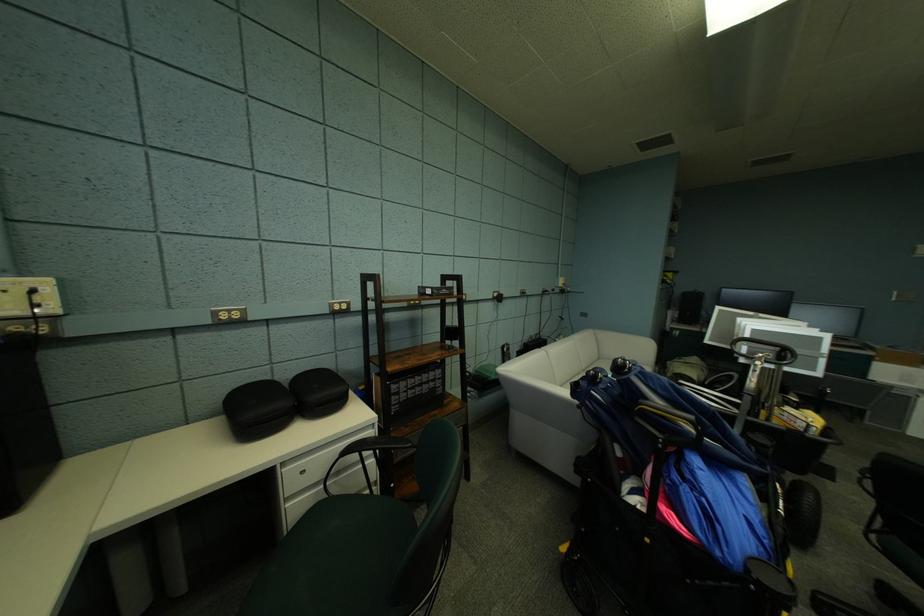
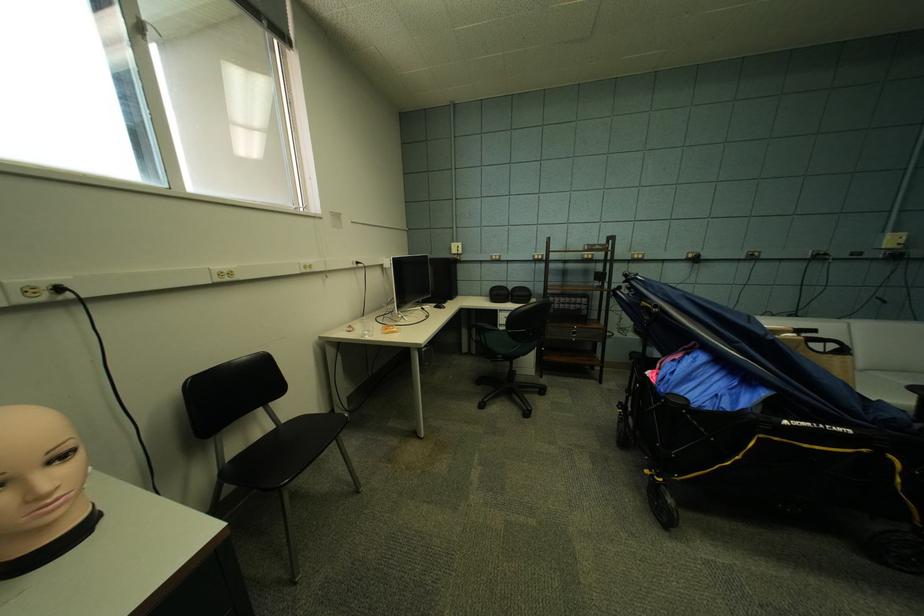
Find the pixel in the second image that matches [454,292] in the first image.

(606, 248)